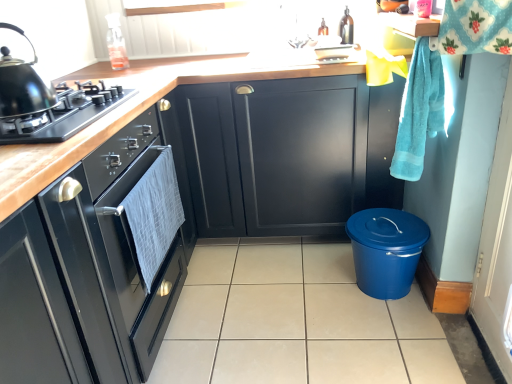
The image size is (512, 384). I want to click on free spot above beige tile at center (from a real-world perspective), so click(298, 298).